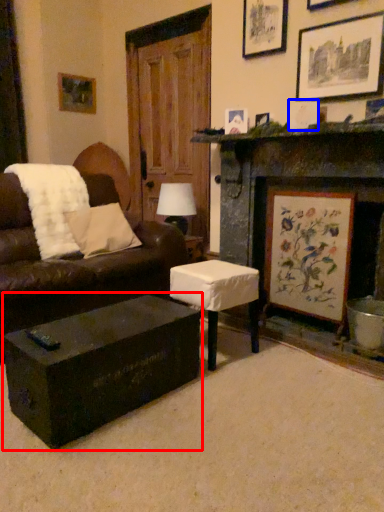
Question: Which point is further to the camera, coffee table (highlighted by a red box) or picture frame (highlighted by a blue box)?

Choices:
 (A) coffee table
 (B) picture frame

Answer: (B)